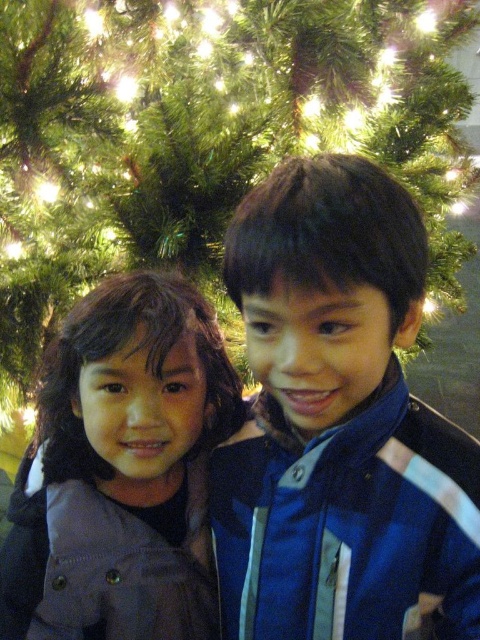
Question: Is green textured fir tree at upper center closer to camera compared to blue fabric jacket at center?

Choices:
 (A) no
 (B) yes

Answer: (A)

Question: Among these objects, which one is farthest from the camera?

Choices:
 (A) blue fabric jacket at center
 (B) green textured fir tree at upper center

Answer: (B)

Question: Which point is farther to the camera?

Choices:
 (A) matte gray jacket at center
 (B) blue fabric jacket at center
 (C) green textured fir tree at upper center

Answer: (C)

Question: Considering the real-world distances, which object is closest to the matte gray jacket at center?

Choices:
 (A) green textured fir tree at upper center
 (B) blue fabric jacket at center

Answer: (B)

Question: Can you confirm if blue fabric jacket at center is positioned to the right of matte gray jacket at center?

Choices:
 (A) no
 (B) yes

Answer: (B)

Question: Does green textured fir tree at upper center appear on the right side of blue fabric jacket at center?

Choices:
 (A) no
 (B) yes

Answer: (B)